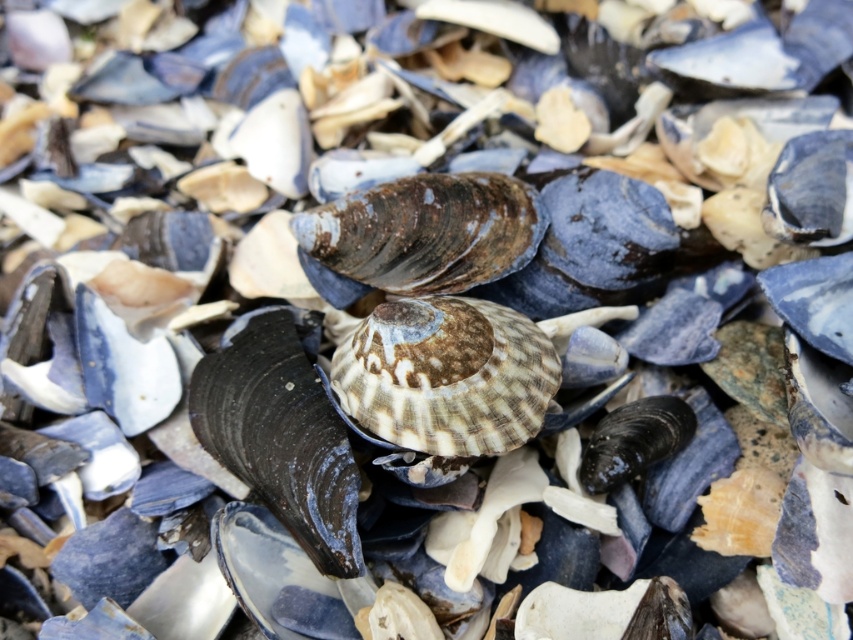
From the picture: Is speckled brown shell at center positioned in front of rusty metallic shellfish at center?

Yes, it is.

Who is positioned more to the left, speckled brown shell at center or rusty metallic shellfish at center?

From the viewer's perspective, rusty metallic shellfish at center appears more on the left side.

Which is in front, point (462, 330) or point (502, 212)?

Point (462, 330) is in front.

Where is `speckled brown shell at center`? speckled brown shell at center is located at coordinates click(445, 376).